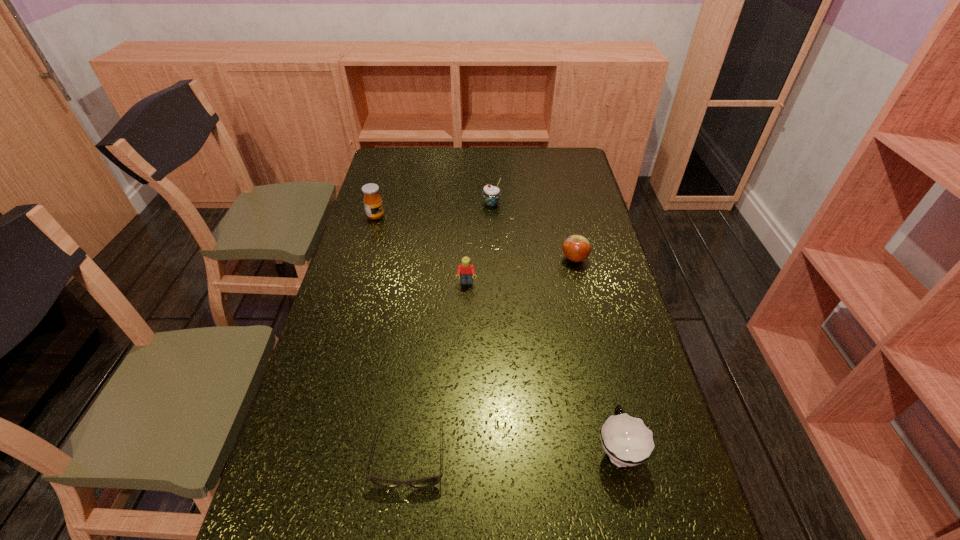
This screenshot has height=540, width=960. I want to click on honey, so click(372, 200).

Where is `the second farthest object`? This screenshot has height=540, width=960. the second farthest object is located at coordinates (372, 200).

Find the location of `the fourth object from left to right`. the fourth object from left to right is located at coordinates (491, 194).

You are a GUI agent. You are given a task and a screenshot of the screen. Output one action in this format:
    pyautogui.click(x=<x>, y=<y>)
    Task: Click on the farthest object
    Image resolution: width=960 pixels, height=540 pixels.
    Given the screenshot: What is the action you would take?
    pyautogui.click(x=491, y=194)

This screenshot has height=540, width=960. Find the location of `Lego`. Lego is located at coordinates (465, 270).

Identify the location of the fourth object from right to left. Image resolution: width=960 pixels, height=540 pixels. (465, 270).

The image size is (960, 540). What are the coordinates of `cup` in the screenshot? It's located at (627, 441).

I want to click on apple, so click(576, 248).

Find the location of a particular element. This screenshot has width=960, height=540. the second object from left to right is located at coordinates (427, 482).

Find the location of a particular element. sunglasses is located at coordinates (427, 482).